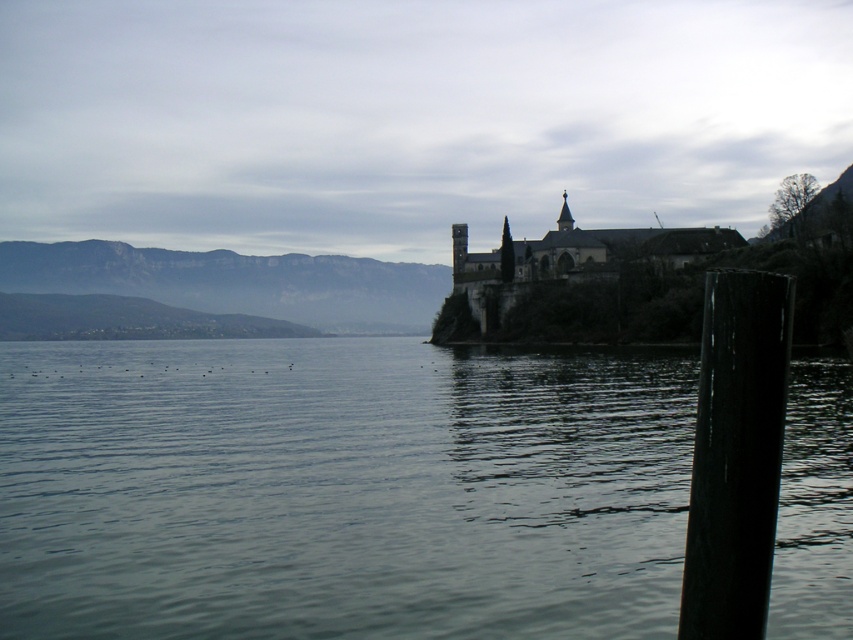
You are standing at the edge of the lakeside scene and want to locate the smooth dark water at center. According to the coordinates provided, where would you look to find it?

The smooth dark water at center is located at the 2D coordinates point (339, 490).

You are a tourist standing at the lakeside and want to take a photo of the dark stone castle at center. However, the black smooth pole at right is blocking part of your view. Can you estimate whether the pole is smaller than the castle in the photo?

The black smooth pole at right is smaller than the dark stone castle at center, so it may not completely block the view of the castle in the photo.

You are a photographer planning to capture the historic building in the background. You notice the smooth dark water at center and the black smooth pole at right in your shot. Which object should you move to the left to frame the building better?

You should move the black smooth pole at right to the left to frame the historic building better since the smooth dark water at center is already on the left side of the black smooth pole at right.